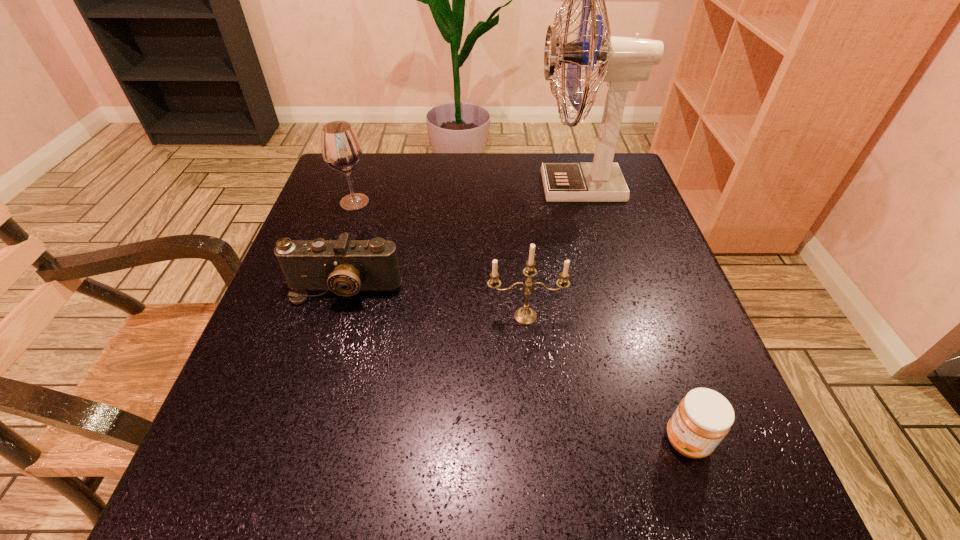
Where is `jam that is positioned at the right edge`? jam that is positioned at the right edge is located at coordinates (704, 417).

Locate an element on the screen. This screenshot has width=960, height=540. object situated at the far left corner is located at coordinates (341, 149).

This screenshot has height=540, width=960. Find the location of `object located at the far right corner`. object located at the far right corner is located at coordinates (623, 61).

Where is `object located in the near right corner section of the desktop`? This screenshot has width=960, height=540. object located in the near right corner section of the desktop is located at coordinates tap(704, 417).

Locate an element on the screen. vacant space at the far edge of the desktop is located at coordinates (481, 169).

Where is `free space at the near edge of the desktop`? free space at the near edge of the desktop is located at coordinates (651, 516).

Where is `vacant point at the left edge`? The height and width of the screenshot is (540, 960). vacant point at the left edge is located at coordinates (326, 384).

Where is `vacant space at the right edge of the desktop`? The height and width of the screenshot is (540, 960). vacant space at the right edge of the desktop is located at coordinates (675, 330).

The width and height of the screenshot is (960, 540). In the image, there is a desktop. Identify the location of vacant space at the far left corner. (326, 197).

Identify the location of free location at the near left corner. (269, 472).